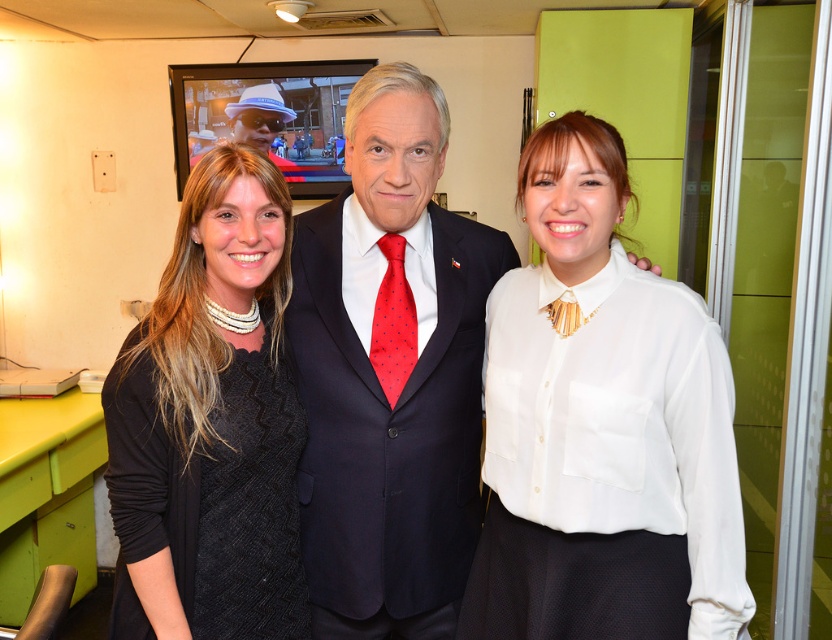
Question: Is black textured sweater at left bigger than dark blue wool suit at center?

Choices:
 (A) yes
 (B) no

Answer: (B)

Question: Is white satin blouse at center behind dark blue wool suit at center?

Choices:
 (A) no
 (B) yes

Answer: (A)

Question: Considering the real-world distances, which object is closest to the red dotted silk tie at center?

Choices:
 (A) dark blue wool suit at center
 (B) black matte dress at center
 (C) white satin blouse at center

Answer: (A)

Question: Is black textured sweater at left wider than red dotted silk tie at center?

Choices:
 (A) no
 (B) yes

Answer: (B)

Question: Which object is closer to the camera taking this photo?

Choices:
 (A) black textured sweater at left
 (B) white satin blouse at center

Answer: (B)

Question: Which point is farther to the camera?

Choices:
 (A) (293, 326)
 (B) (234, 570)
 (C) (389, 397)
 (D) (603, 358)

Answer: (A)